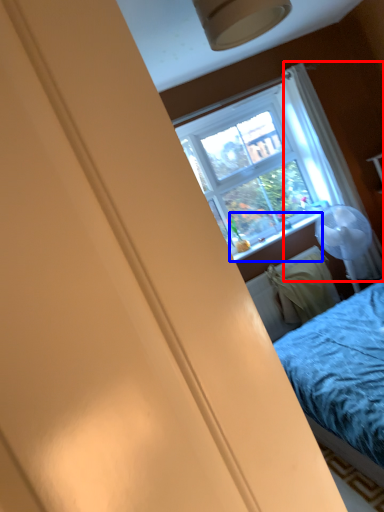
Question: Among these objects, which one is farthest to the camera, curtain (highlighted by a red box) or window sill (highlighted by a blue box)?

Choices:
 (A) curtain
 (B) window sill

Answer: (B)